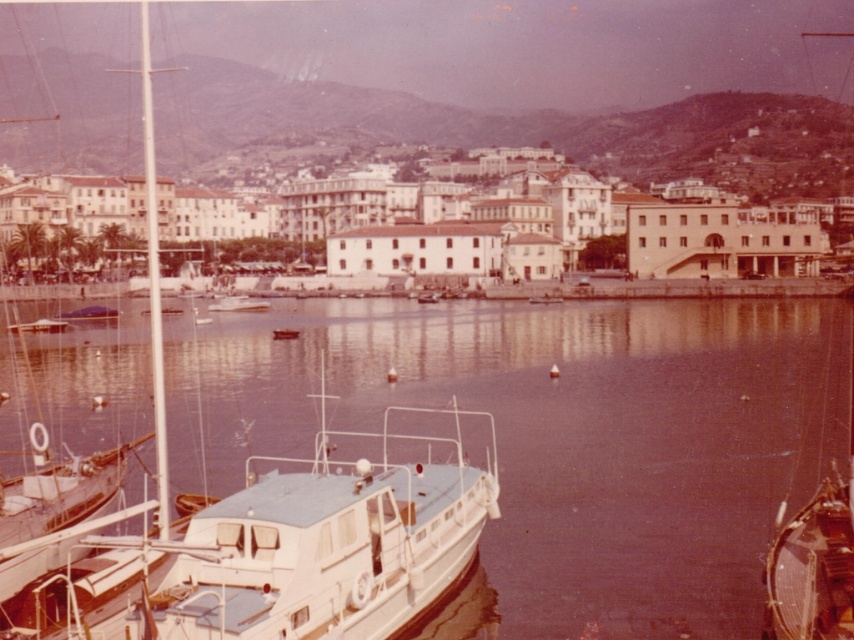
Question: Observing the image, what is the correct spatial positioning of clear water at center in reference to white glossy boat at left?

Choices:
 (A) left
 (B) right

Answer: (B)

Question: Can you confirm if clear water at center is wider than wooden polished boat at lower right?

Choices:
 (A) no
 (B) yes

Answer: (B)

Question: Which of the following is the closest to the observer?

Choices:
 (A) clear water at center
 (B) white glossy boat at left

Answer: (B)

Question: Is white glossy boat at left to the right of wooden polished boat at lower right from the viewer's perspective?

Choices:
 (A) no
 (B) yes

Answer: (A)

Question: Which point is farther from the camera taking this photo?

Choices:
 (A) (331, 634)
 (B) (615, 588)

Answer: (B)

Question: Which point is farther from the camera taking this photo?

Choices:
 (A) (199, 518)
 (B) (62, 349)
 (C) (60, 636)
 (D) (782, 628)

Answer: (B)